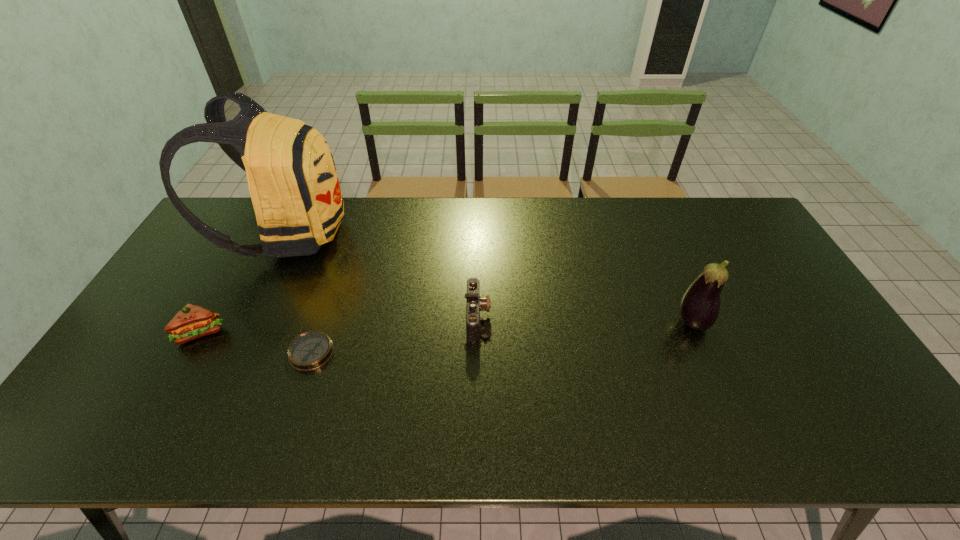
Locate an element on the screen. free space at the far right corner is located at coordinates (712, 228).

At what (x,y) coordinates should I click in order to perform the action: click on free space between the third tallest object and the second tallest object. Please return your answer as a coordinate pair (x, y). Looking at the image, I should click on (446, 327).

Locate an element on the screen. vacant region between the compass and the fourth tallest object is located at coordinates (395, 335).

What are the coordinates of `vacant space that is in between the fourth shortest object and the third shortest object` in the screenshot? It's located at (446, 327).

Identify the location of vacant space that's between the farthest object and the sandwich. This screenshot has width=960, height=540. (246, 283).

At what (x,y) coordinates should I click in order to perform the action: click on free spot between the eggplant and the tallest object. Please return your answer as a coordinate pair (x, y). Looking at the image, I should click on (491, 278).

At what (x,y) coordinates should I click in order to perform the action: click on free area in between the tallest object and the fourth tallest object. Please return your answer as a coordinate pair (x, y). Looking at the image, I should click on (383, 275).

Identify the location of vacant area between the tallest object and the camera. The image size is (960, 540). (383, 275).

This screenshot has width=960, height=540. Identify the location of free space between the farthest object and the second object from right to left. (383, 275).

At what (x,y) coordinates should I click in order to perform the action: click on free space between the rightmost object and the fourth object from left to right. Please return your answer as a coordinate pair (x, y). Looking at the image, I should click on (585, 320).